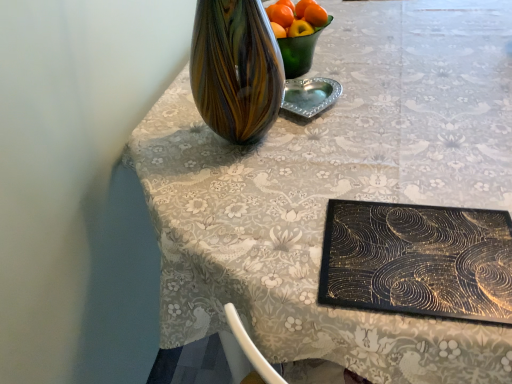
Question: In which direction should I rotate to look at silver metallic heart-shaped tray at center?

Choices:
 (A) left
 (B) right

Answer: (B)

Question: Is silver metallic heart-shaped tray at center to the right of orange matte at upper center from the viewer's perspective?

Choices:
 (A) no
 (B) yes

Answer: (B)

Question: Does silver metallic heart-shaped tray at center have a larger size compared to orange matte at upper center?

Choices:
 (A) no
 (B) yes

Answer: (B)

Question: Is orange matte at upper center located within silver metallic heart-shaped tray at center?

Choices:
 (A) no
 (B) yes

Answer: (A)

Question: Is silver metallic heart-shaped tray at center completely or partially outside of orange matte at upper center?

Choices:
 (A) no
 (B) yes

Answer: (B)

Question: From a real-world perspective, is silver metallic heart-shaped tray at center on orange matte at upper center?

Choices:
 (A) yes
 (B) no

Answer: (B)

Question: Considering the relative sizes of silver metallic heart-shaped tray at center and orange matte at upper center in the image provided, is silver metallic heart-shaped tray at center wider than orange matte at upper center?

Choices:
 (A) yes
 (B) no

Answer: (A)

Question: Is orange matte at upper center closer to camera compared to silver metallic heart-shaped tray at center?

Choices:
 (A) no
 (B) yes

Answer: (A)

Question: Is orange matte at upper center not within silver metallic heart-shaped tray at center?

Choices:
 (A) no
 (B) yes

Answer: (B)

Question: From a real-world perspective, does orange matte at upper center stand above silver metallic heart-shaped tray at center?

Choices:
 (A) no
 (B) yes

Answer: (B)

Question: Does orange matte at upper center appear on the right side of silver metallic heart-shaped tray at center?

Choices:
 (A) yes
 (B) no

Answer: (B)

Question: From the image's perspective, would you say orange matte at upper center is positioned over silver metallic heart-shaped tray at center?

Choices:
 (A) no
 (B) yes

Answer: (B)

Question: Is orange matte at upper center looking in the opposite direction of silver metallic heart-shaped tray at center?

Choices:
 (A) no
 (B) yes

Answer: (A)

Question: From the image's perspective, relative to silver metallic heart-shaped tray at center, is orange matte at upper center above or below?

Choices:
 (A) below
 (B) above

Answer: (B)